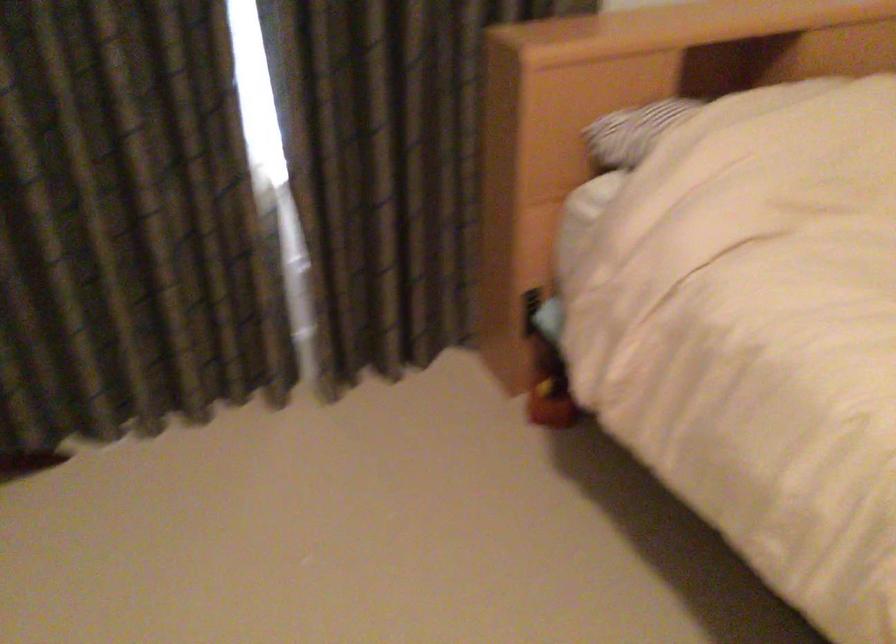
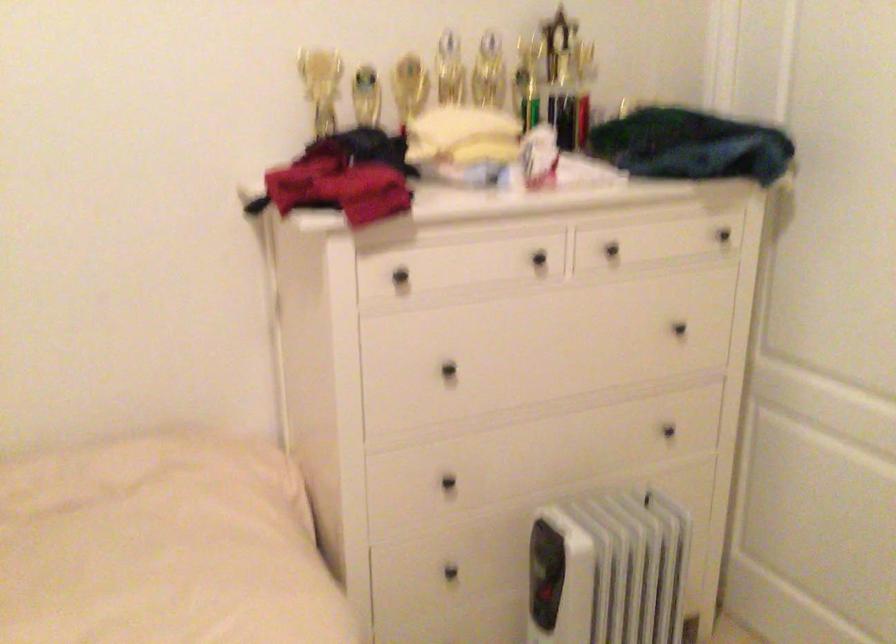
Question: The camera is either moving clockwise (left) or counter-clockwise (right) around the object. The first image is from the beginning of the video and the second image is from the end. Is the camera moving left or right when shooting the video?

Choices:
 (A) Left
 (B) Right

Answer: (A)